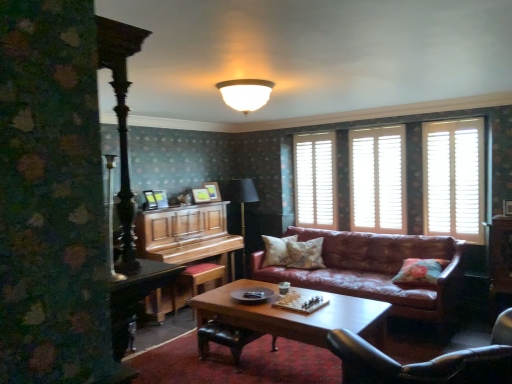
What do you see at coordinates (426, 361) in the screenshot? I see `black leather chair at lower right` at bounding box center [426, 361].

The width and height of the screenshot is (512, 384). Describe the element at coordinates (245, 93) in the screenshot. I see `white frosted glass lampshade at upper center` at that location.

Where is `wooden glossy coffee table at center`? The height and width of the screenshot is (384, 512). wooden glossy coffee table at center is located at coordinates 295,315.

This screenshot has height=384, width=512. What do you see at coordinates (420, 272) in the screenshot? I see `floral fabric pillow at right, which is counted as the third pillow, starting from the left` at bounding box center [420, 272].

The width and height of the screenshot is (512, 384). In order to click on fluffy beige pillow at center, arranged as the first pillow when viewed from the back in this screenshot , I will do (276, 250).

The image size is (512, 384). I want to click on black leather chair at lower right, so click(x=426, y=361).

From the image's perspective, does black leather footrest at lower center appear lower than floral fabric pillow at right, which is counted as the third pillow, starting from the left?

Indeed, from the image's perspective, black leather footrest at lower center is shown beneath floral fabric pillow at right, which is counted as the third pillow, starting from the left.

Is black leather footrest at lower center touching floral fabric pillow at right, which is counted as the third pillow, starting from the left?

They are not placed beside each other.

Considering the positions of objects black leather footrest at lower center and floral fabric pillow at right, marked as the 1th pillow in a right-to-left arrangement, in the image provided, who is in front, black leather footrest at lower center or floral fabric pillow at right, marked as the 1th pillow in a right-to-left arrangement,?

Positioned in front is black leather footrest at lower center.

How many degrees apart are the facing directions of black leather footrest at lower center and floral fabric pillow at right, which is counted as the third pillow, starting from the left?

black leather footrest at lower center and floral fabric pillow at right, which is counted as the third pillow, starting from the left, are facing 1.49 degrees away from each other.

Which object is closer to the camera, fluffy beige pillow at center, placed as the second pillow when sorted from back to front, or leather couch at center?

leather couch at center is more forward.

Consider the image. Considering the relative sizes of fluffy beige pillow at center, the second pillow when ordered from left to right, and leather couch at center in the image provided, is fluffy beige pillow at center, the second pillow when ordered from left to right, shorter than leather couch at center?

Yes, fluffy beige pillow at center, the second pillow when ordered from left to right, is shorter than leather couch at center.

The width and height of the screenshot is (512, 384). Find the location of `studio couch below the fluffy beige pillow at center, the second pillow when ordered from left to right (from the image's perspective)`. studio couch below the fluffy beige pillow at center, the second pillow when ordered from left to right (from the image's perspective) is located at coordinates (377, 271).

Considering the sizes of objects fluffy beige pillow at center, placed as the second pillow when sorted from back to front, and leather couch at center in the image provided, who is thinner, fluffy beige pillow at center, placed as the second pillow when sorted from back to front, or leather couch at center?

fluffy beige pillow at center, placed as the second pillow when sorted from back to front.

Considering the positions of objects white wooden shutters at upper right, acting as the 2th bay window starting from the back, and wooden stool at lower left in the image provided, who is in front, white wooden shutters at upper right, acting as the 2th bay window starting from the back, or wooden stool at lower left?

white wooden shutters at upper right, acting as the 2th bay window starting from the back, is closer to the camera.

Considering the points (439, 128) and (207, 280), which point is in front, point (439, 128) or point (207, 280)?

The point (439, 128) is closer to the camera.

From a real-world perspective, which is physically above, white wooden shutters at upper right, the first bay window from the front, or wooden stool at lower left?

In real-world perspective, white wooden shutters at upper right, the first bay window from the front, is above.

This screenshot has height=384, width=512. Identify the location of stool behind the white wooden shutters at upper right, acting as the 2th bay window starting from the back. (201, 276).

Can you confirm if wooden glossy coffee table at center is taller than wooden piano at center?

Incorrect, the height of wooden glossy coffee table at center is not larger of that of wooden piano at center.

From the image's perspective, is wooden glossy coffee table at center on wooden piano at center?

Incorrect, from the image's perspective, wooden glossy coffee table at center is lower than wooden piano at center.

Is wooden glossy coffee table at center thinner than wooden piano at center?

In fact, wooden glossy coffee table at center might be wider than wooden piano at center.

Is leather couch at center inside or outside of white frosted glass lampshade at upper center?

leather couch at center is outside white frosted glass lampshade at upper center.

Can you confirm if leather couch at center is positioned to the right of white frosted glass lampshade at upper center?

Yes, leather couch at center is to the right of white frosted glass lampshade at upper center.

From a real-world perspective, which is physically below, leather couch at center or white frosted glass lampshade at upper center?

leather couch at center is physically lower.

Identify the location of studio couch below the white frosted glass lampshade at upper center (from the image's perspective). (377, 271).

From the image's perspective, is floral fabric pillow at right, which is counted as the third pillow, starting from the left, located beneath leather couch at center?

No.

Locate an element on the screen. The image size is (512, 384). studio couch below the floral fabric pillow at right, marked as the 1th pillow in a right-to-left arrangement (from a real-world perspective) is located at coordinates (377, 271).

Is floral fabric pillow at right, which is counted as the third pillow, starting from the left, inside or outside of leather couch at center?

The correct answer is: inside.

Which object is wider, floral fabric pillow at right, the third pillow viewed from the back, or leather couch at center?

leather couch at center.

Does white wooden shutters at upper right, the first bay window from the front, have a lesser width compared to leather couch at center?

Yes, white wooden shutters at upper right, the first bay window from the front, is thinner than leather couch at center.

From their relative heights in the image, would you say white wooden shutters at upper right, which appears as the 2th bay window when viewed from the left, is taller or shorter than leather couch at center?

white wooden shutters at upper right, which appears as the 2th bay window when viewed from the left, is taller than leather couch at center.

Are white wooden shutters at upper right, which ranks as the 1th bay window in right-to-left order, and leather couch at center making contact?

No, white wooden shutters at upper right, which ranks as the 1th bay window in right-to-left order, is not beside leather couch at center.

Find the location of a particular element. footrest below the floral fabric pillow at right, marked as the 1th pillow in a right-to-left arrangement (from a real-world perspective) is located at coordinates (225, 338).

The height and width of the screenshot is (384, 512). In order to click on studio couch that is on the right side of fluffy beige pillow at center, the second pillow positioned from the front in this screenshot , I will do `click(377, 271)`.

Looking at the image, which one is located closer to wooden stool at lower left, white wooden shutters at center, which is the 2th bay window from front to back, or white frosted glass lampshade at upper center?

white frosted glass lampshade at upper center lies closer to wooden stool at lower left than the other object.

When comparing their distances from white wooden shutters at center, which is the 2th bay window from front to back, does white frosted glass lampshade at upper center or leather couch at center seem further?

The object further to white wooden shutters at center, which is the 2th bay window from front to back, is white frosted glass lampshade at upper center.

When comparing their distances from white wooden shutters at upper right, does floral fabric pillow at right, the third pillow viewed from the back, or black fabric floor lamp at center seem closer?

Based on the image, black fabric floor lamp at center appears to be nearer to white wooden shutters at upper right.

From the image, which object appears to be farther from white wooden shutters at upper right, wooden piano at center or wooden stool at lower left?

Among the two, wooden stool at lower left is located further to white wooden shutters at upper right.

Which object lies nearer to the anchor point black leather chair at lower right, wooden piano at center or fluffy beige pillow at center, arranged as the first pillow when viewed from the back?

fluffy beige pillow at center, arranged as the first pillow when viewed from the back, lies closer to black leather chair at lower right than the other object.

From the image, which object appears to be farther from black fabric floor lamp at center, fluffy beige pillow at center, placed as the second pillow when sorted from back to front, or black leather chair at lower right?

black leather chair at lower right is positioned further to the anchor black fabric floor lamp at center.

When comparing their distances from leather couch at center, does wooden glossy coffee table at center or wooden piano at center seem closer?

wooden glossy coffee table at center lies closer to leather couch at center than the other object.

Consider the image. Estimate the real-world distances between objects in this image. Which object is further from wooden piano at center, black fabric floor lamp at center or black leather footrest at lower center?

black leather footrest at lower center.

I want to click on lamp positioned between black leather chair at lower right and black fabric floor lamp at center from near to far, so click(x=245, y=93).

At what (x,y) coordinates should I click in order to perform the action: click on studio couch located between wooden piano at center and white wooden shutters at center, acting as the first bay window starting from the left, in the left-right direction. Please return your answer as a coordinate pair (x, y). The image size is (512, 384). Looking at the image, I should click on (377, 271).

The image size is (512, 384). Find the location of `pillow located between black fabric floor lamp at center and fluffy beige pillow at center, which is the 2th pillow in right-to-left order, in the left-right direction`. pillow located between black fabric floor lamp at center and fluffy beige pillow at center, which is the 2th pillow in right-to-left order, in the left-right direction is located at coordinates (276, 250).

This screenshot has height=384, width=512. Identify the location of stool located between wooden glossy coffee table at center and white wooden shutters at upper right in the depth direction. (201, 276).